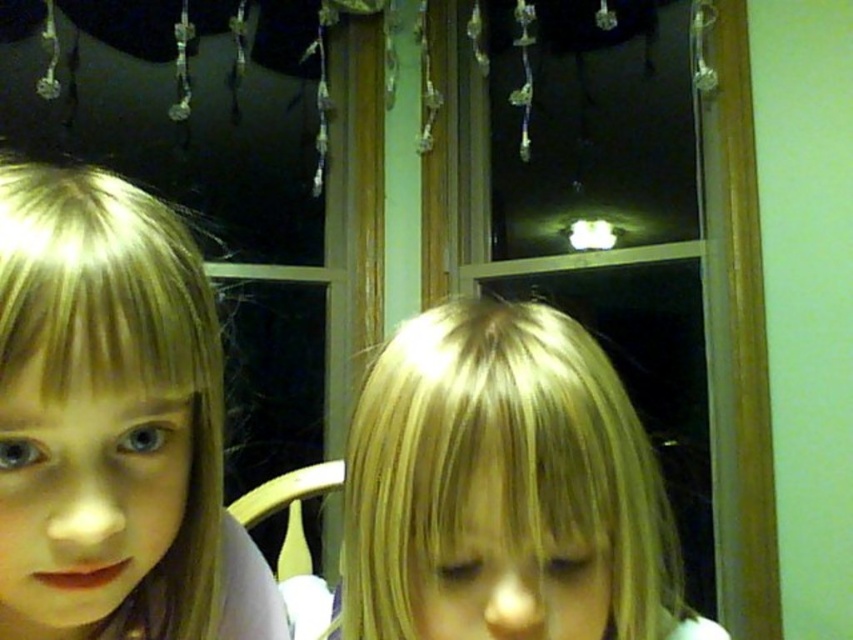
You are a photographer standing 6 feet away from the two children with blonde hair at left and blonde hair at center. You want to take a photo that includes both children in the frame. Based on the distance between their blonde hair, will you need to adjust your camera angle to ensure both are fully visible?

The distance between the blonde hair at left and blonde hair at center is 4.53 inches. Since you are standing 6 feet away, this distance is small enough that you can likely capture both children in the frame without needing to adjust your camera angle significantly.

You are a hair stylist observing two children with blonde hair in the scene. The child on the left has blonde hair at left, and the child on the right has blonde hair at center. Which child has thicker hair?

The child with blonde hair at center has thicker hair than the child with blonde hair at left.

You are a photographer adjusting the camera focus. The camera is currently focused on the point at point (113, 420). Which child should be in focus? Please answer with the object label from the scene description.

The camera is focused on the point at point (113, 420), which is where the blonde hair at left is located. Therefore, the child on the left should be in focus.